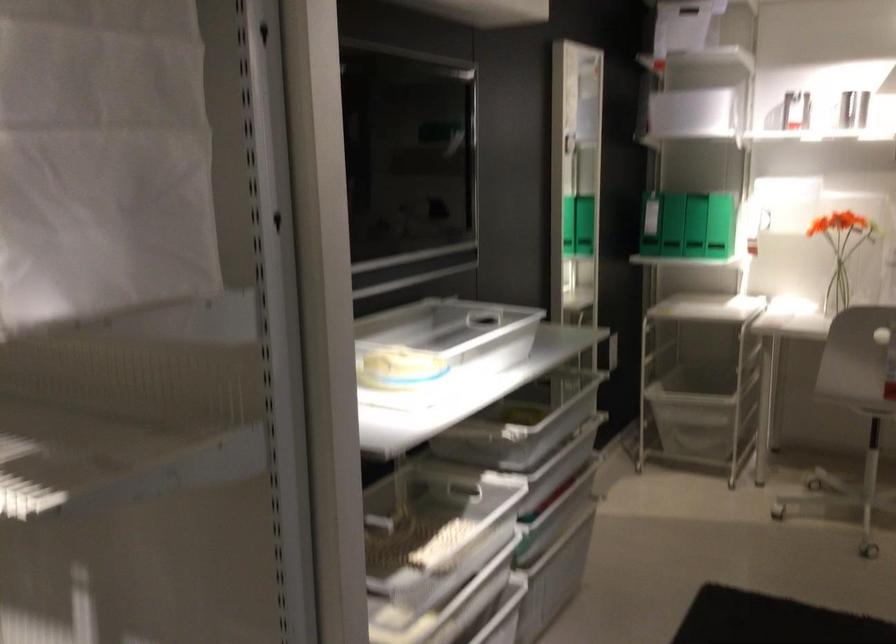
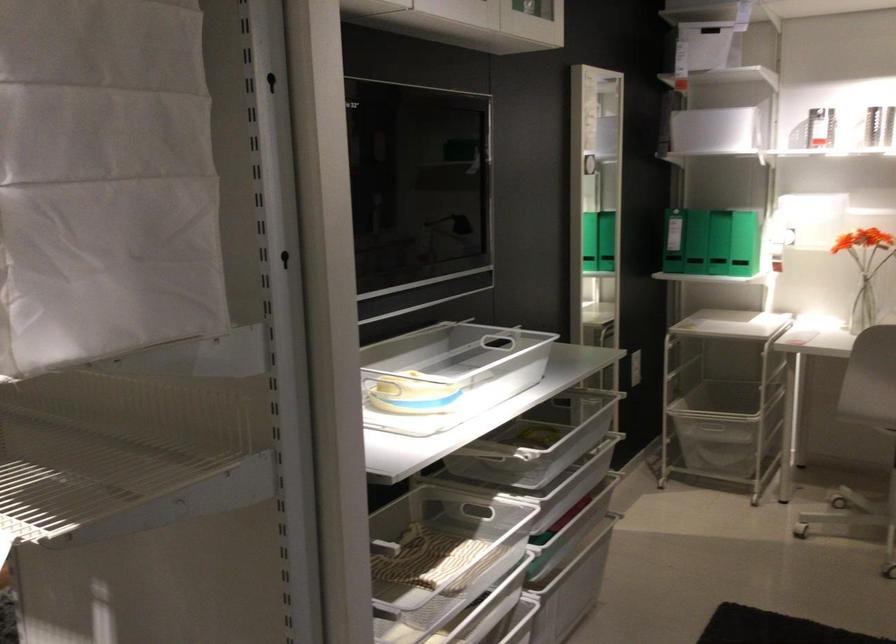
Find the pixel in the second image that matches point 702,408 in the first image.

(712, 430)